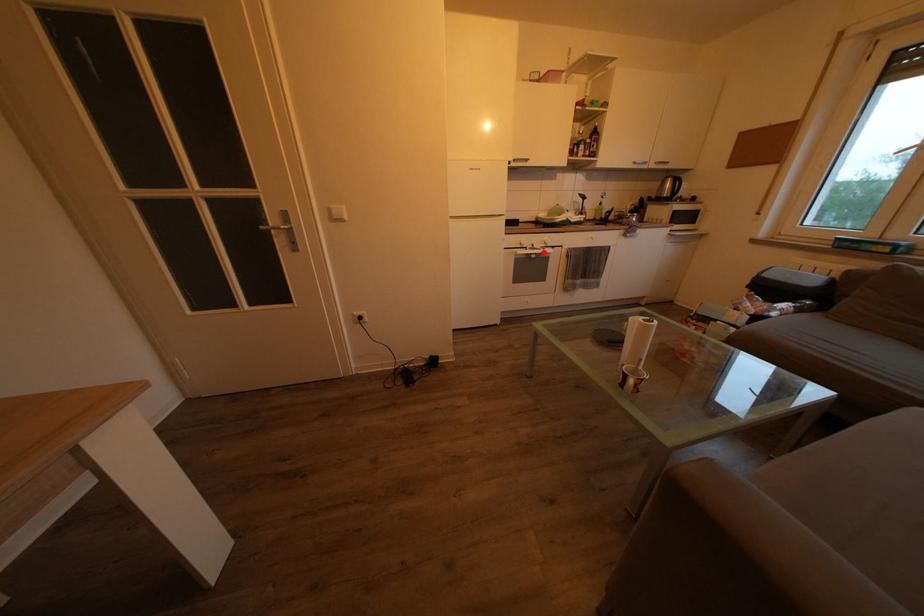
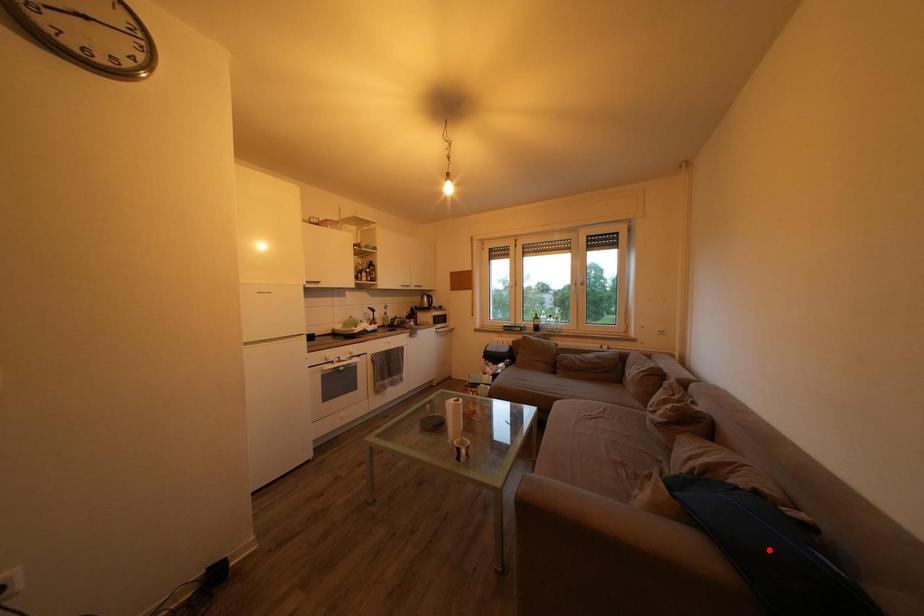
I am providing you with two images of the same scene from different viewpoints. A red point is marked on the first image and another point is marked on the second image. Are the points marked in image1 and image2 representing the same 3D position?

No